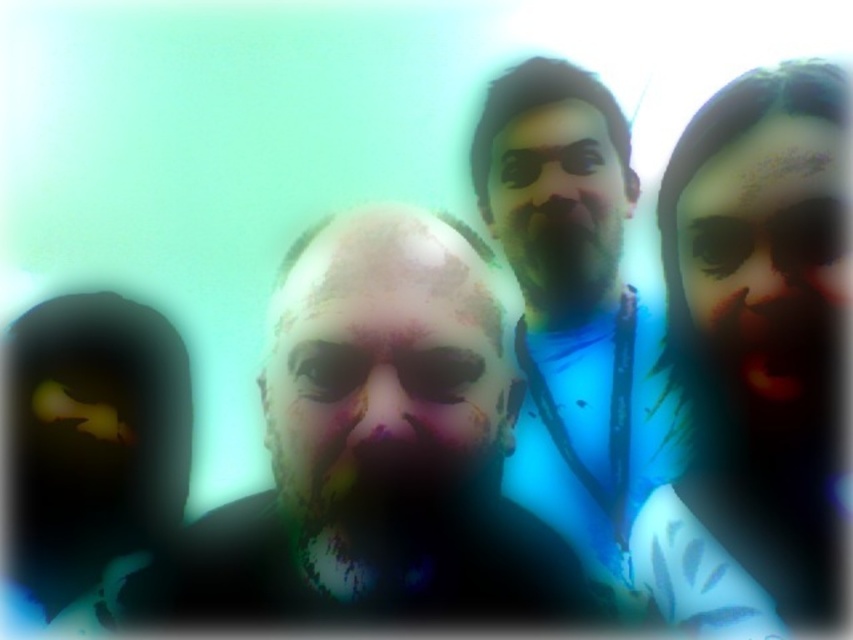
Looking at the selfie with the dark skin face at center and the blue fabric shirt at center, which one appears taller?

The dark skin face at center has a lesser height compared to the blue fabric shirt at center, so the blue fabric shirt at center appears taller.

In the selfie, there are two central elements visible at the center of the image. The first is the blue fabric shirt at center, and the second is the smooth skin face at center. Which of these two items occupies a bigger area in the image?

The blue fabric shirt at center has a larger size compared to the smooth skin face at center, so the blue fabric shirt at center occupies a bigger area in the image.